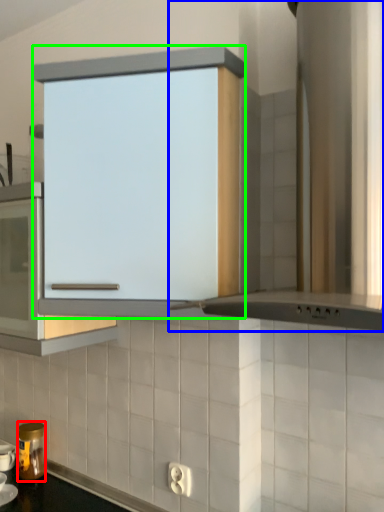
Question: Which is farther away from kitchen appliance (highlighted by a red box)? home appliance (highlighted by a blue box) or cabinetry (highlighted by a green box)?

Choices:
 (A) home appliance
 (B) cabinetry

Answer: (A)